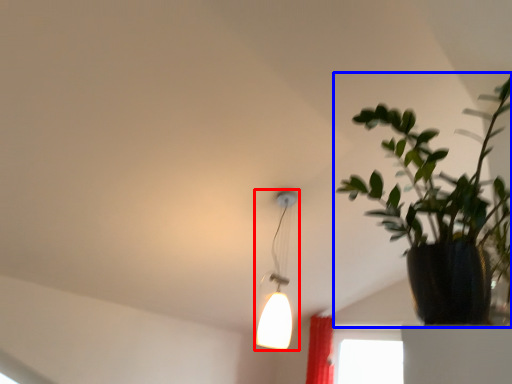
Question: Which object appears closest to the camera in this image, lamp (highlighted by a red box) or houseplant (highlighted by a blue box)?

Choices:
 (A) lamp
 (B) houseplant

Answer: (B)